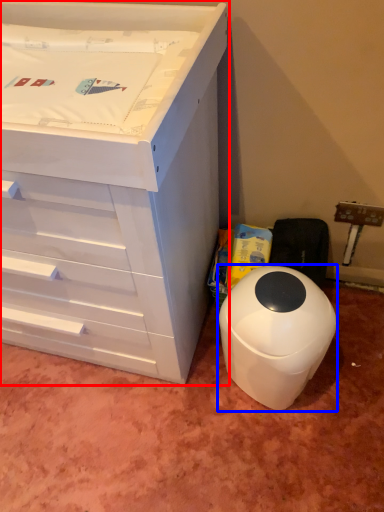
Question: Which of the following is the closest to the observer, chest of drawers (highlighted by a red box) or waste container (highlighted by a blue box)?

Choices:
 (A) chest of drawers
 (B) waste container

Answer: (A)